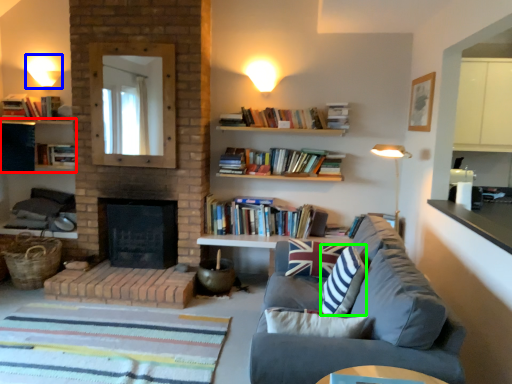
Question: Which object is the farthest from shelf (highlighted by a red box)? Choose among these: lighting (highlighted by a blue box) or pillow (highlighted by a green box).

Choices:
 (A) lighting
 (B) pillow

Answer: (B)